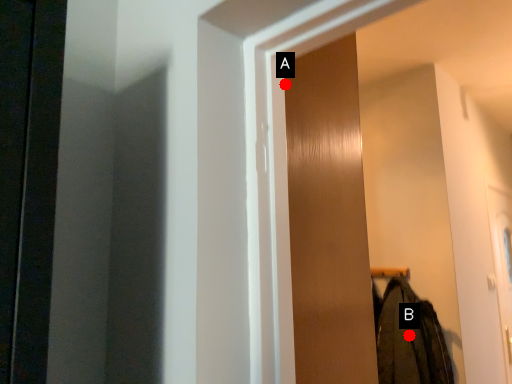
Question: Two points are circled on the image, labeled by A and B beside each circle. Which of the following is the closest to the observer?

Choices:
 (A) A is closer
 (B) B is closer

Answer: (A)